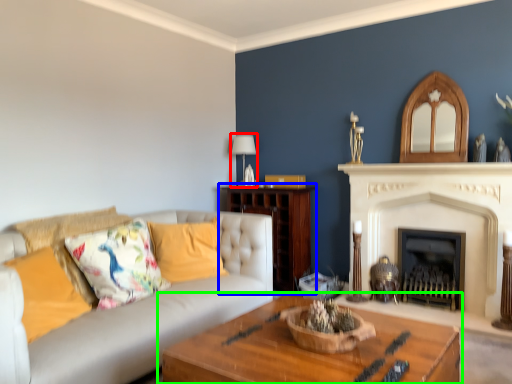
Question: Which object is positioned farthest from lamp (highlighted by a red box)? Select from hardwood (highlighted by a blue box) and table (highlighted by a green box).

Choices:
 (A) hardwood
 (B) table

Answer: (B)